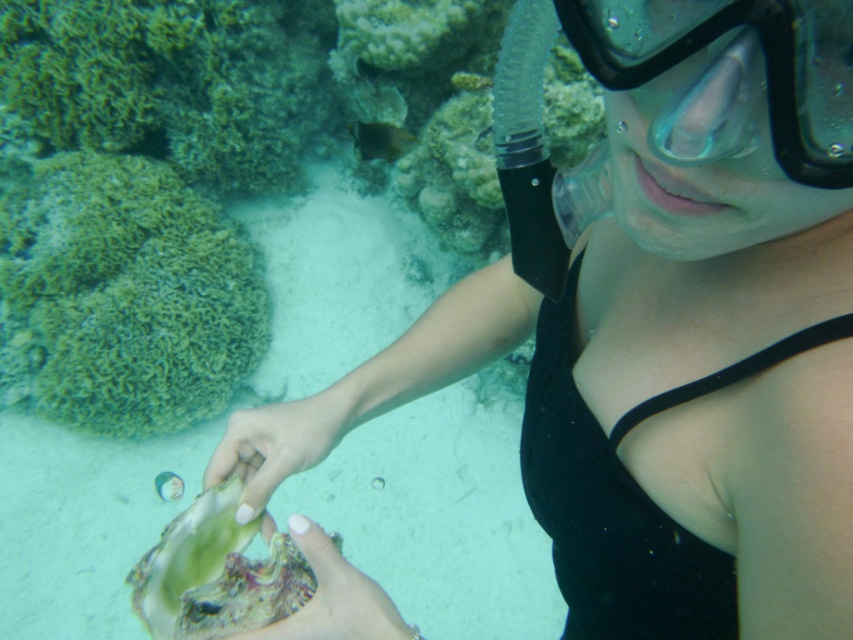
Between green soft coral at left and green iridescent shell at center, which one appears on the left side from the viewer's perspective?

From the viewer's perspective, green soft coral at left appears more on the left side.

Does green soft coral at left come behind green iridescent shell at center?

Yes.

Is point (65, 419) behind point (271, 637)?

Yes.

Image resolution: width=853 pixels, height=640 pixels. Identify the location of green soft coral at left. (132, 296).

Who is more distant from viewer, (259, 337) or (805, 116)?

Point (259, 337)

Is the position of green soft coral at left more distant than that of transparent rubber goggles at upper center?

Yes, it is.

What are the coordinates of `green soft coral at left` in the screenshot? It's located at click(132, 296).

Between transparent rubber goggles at upper center and pale skin at center, which one is positioned higher?

transparent rubber goggles at upper center

Identify the location of transparent rubber goggles at upper center. (762, 56).

Find the location of `transparent rubber goggles at upper center`. transparent rubber goggles at upper center is located at coordinates (762, 56).